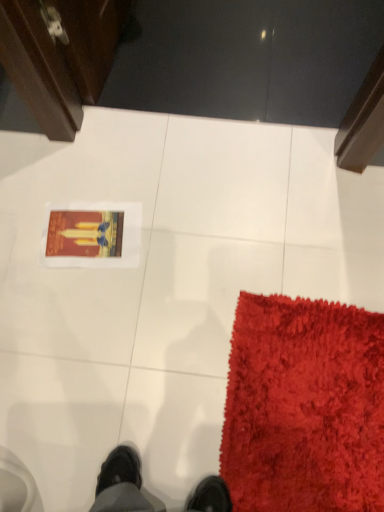
Where is `vacant space positioned to the left of shaggy red rug at lower right`? The height and width of the screenshot is (512, 384). vacant space positioned to the left of shaggy red rug at lower right is located at coordinates (150, 393).